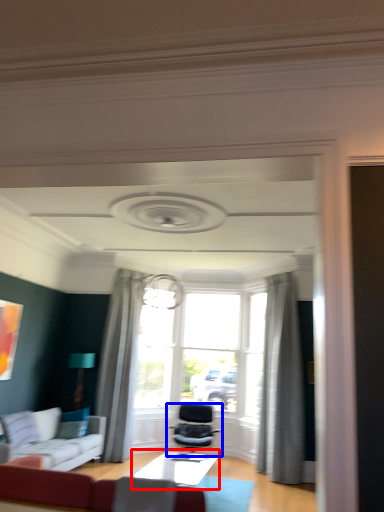
Question: Which point is further to the camera, table (highlighted by a red box) or chair (highlighted by a blue box)?

Choices:
 (A) table
 (B) chair

Answer: (B)